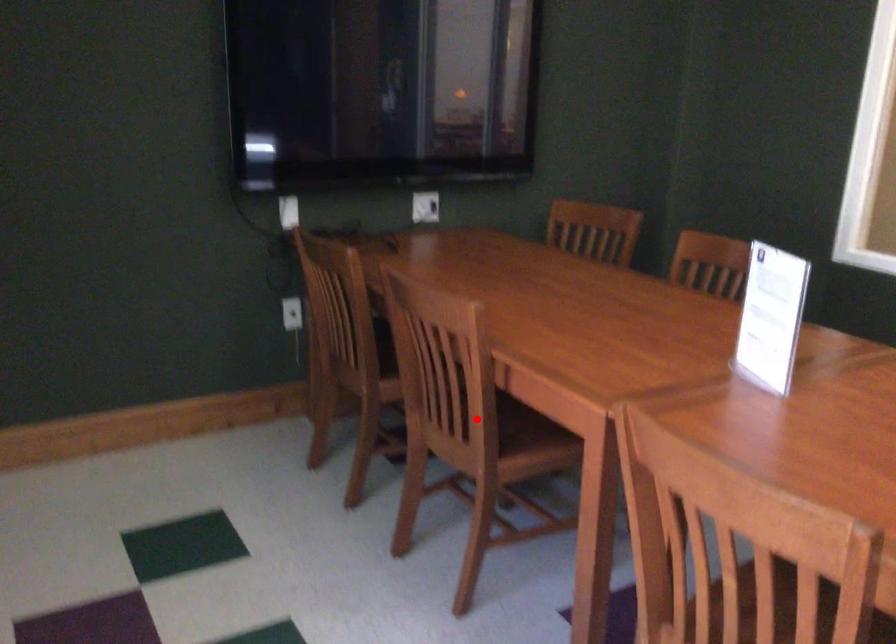
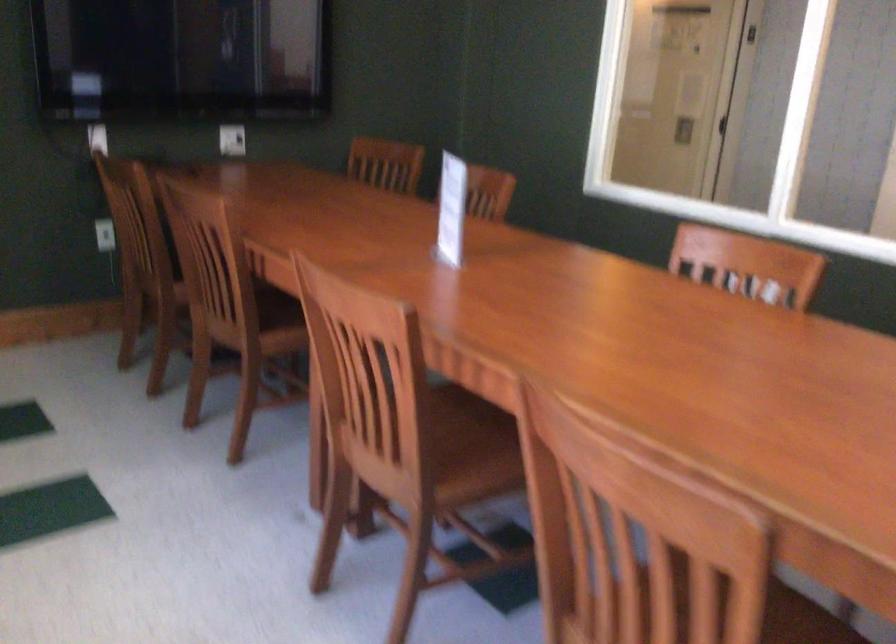
Find the pixel in the second image that matches the highlighted location in the first image.

(239, 303)